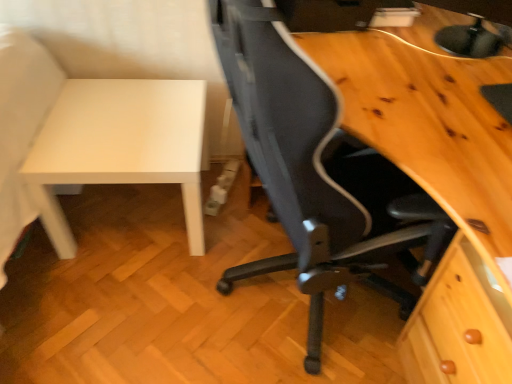
Locate an element on the screen. free space below matte black monitor at upper right (from a real-world perspective) is located at coordinates pos(443,47).